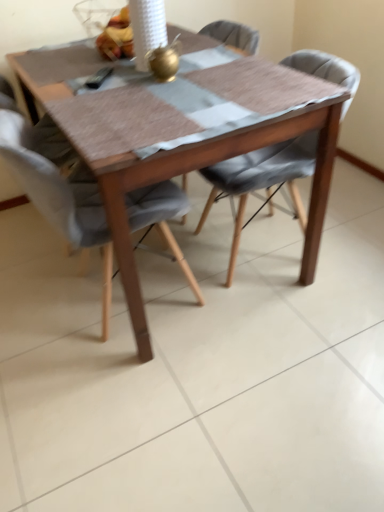
Question: Is shiny plastic bag of fruits at upper center oriented towards light gray fabric chair at center, marked as the second chair in a right-to-left arrangement?

Choices:
 (A) yes
 (B) no

Answer: (B)

Question: Is shiny plastic bag of fruits at upper center to the right of light gray fabric chair at center, which appears as the first chair when viewed from the left, from the viewer's perspective?

Choices:
 (A) no
 (B) yes

Answer: (B)

Question: Does shiny plastic bag of fruits at upper center have a smaller size compared to light gray fabric chair at center, which appears as the first chair when viewed from the left?

Choices:
 (A) yes
 (B) no

Answer: (A)

Question: Is shiny plastic bag of fruits at upper center bigger than light gray fabric chair at center, which appears as the first chair when viewed from the left?

Choices:
 (A) no
 (B) yes

Answer: (A)

Question: From a real-world perspective, is shiny plastic bag of fruits at upper center on top of light gray fabric chair at center, which appears as the first chair when viewed from the left?

Choices:
 (A) yes
 (B) no

Answer: (A)

Question: Can you confirm if shiny plastic bag of fruits at upper center is positioned to the left of light gray fabric chair at center, which appears as the first chair when viewed from the left?

Choices:
 (A) yes
 (B) no

Answer: (B)

Question: Is light gray fabric chair at center, marked as the second chair in a right-to-left arrangement, outside of textured gray cushioned chair at center, the second chair viewed from the left?

Choices:
 (A) yes
 (B) no

Answer: (A)

Question: Considering the relative sizes of light gray fabric chair at center, which appears as the first chair when viewed from the left, and textured gray cushioned chair at center, the second chair viewed from the left, in the image provided, is light gray fabric chair at center, which appears as the first chair when viewed from the left, shorter than textured gray cushioned chair at center, the second chair viewed from the left,?

Choices:
 (A) yes
 (B) no

Answer: (B)

Question: Is light gray fabric chair at center, marked as the second chair in a right-to-left arrangement, further to camera compared to textured gray cushioned chair at center, the 1th chair positioned from the right?

Choices:
 (A) no
 (B) yes

Answer: (A)

Question: Are light gray fabric chair at center, marked as the second chair in a right-to-left arrangement, and textured gray cushioned chair at center, the second chair viewed from the left, far apart?

Choices:
 (A) no
 (B) yes

Answer: (A)

Question: From a real-world perspective, is light gray fabric chair at center, marked as the second chair in a right-to-left arrangement, on top of textured gray cushioned chair at center, the 1th chair positioned from the right?

Choices:
 (A) no
 (B) yes

Answer: (B)

Question: From a real-world perspective, is light gray fabric chair at center, marked as the second chair in a right-to-left arrangement, located beneath textured gray cushioned chair at center, the 1th chair positioned from the right?

Choices:
 (A) no
 (B) yes

Answer: (A)

Question: Is wooden table at center not near textured gray cushioned chair at center, the second chair viewed from the left?

Choices:
 (A) no
 (B) yes

Answer: (A)